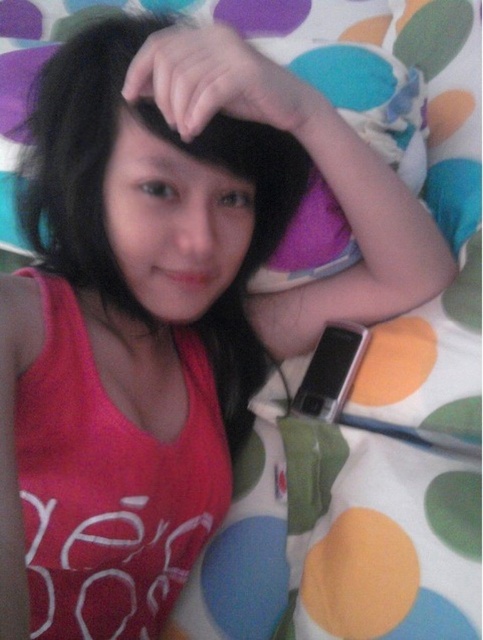
You are a photographer taking a picture of the scene. You need to ensure that the black matte hair at center and the sleek silver phone at lower right are both clearly visible. Which object should you focus on first to ensure proper depth of field?

You should focus on the black matte hair at center first because it has a greater height compared to the sleek silver phone at lower right, ensuring both are in focus.

You are a photographer capturing a candid shot of someone in their bedroom. The subject is lying on a colorful polka dot bedsheet with a black matte hair at center and a sleek silver phone at lower right. You need to ensure the phone is in focus while capturing the hair details. Given the distance between them, what is the minimum focal length required for your camera lens to keep both objects in focus simultaneously?

The distance between black matte hair at center and sleek silver phone at lower right is 10.18 inches. To keep both in focus, the camera lens should have a focal length of at least 50mm.